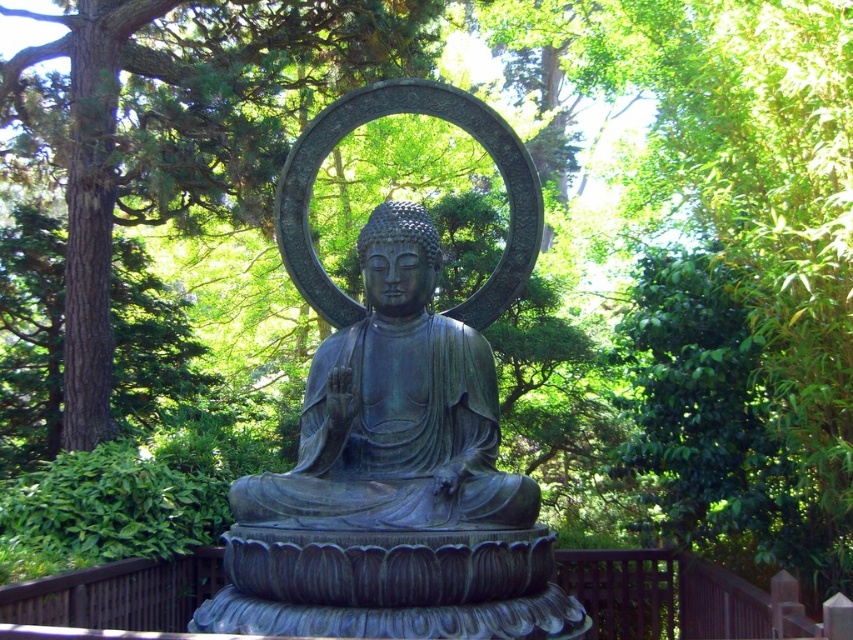
You are a visitor at the temple and want to take a photo of the bronze statue at center. However, you notice that the green leafy tree at center is casting a shadow over the statue. Can you determine if the tree is directly above the statue?

The bronze statue at center is positioned under the green leafy tree at center, so yes, the tree is directly above the statue, which is why it is casting a shadow over it.

You are standing in front of the Buddha statue and want to place two offerings at the points labeled point (521, 604) and point (428, 468). Which point should you place your offering closer to the statue?

Point (521, 604) is in front of point (428, 468), so you should place your offering closer to point (521, 604) as it is nearer to the statue.